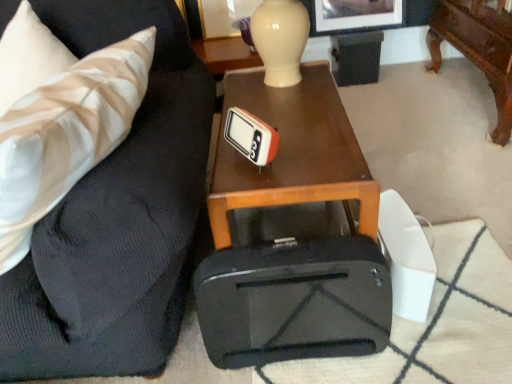
The width and height of the screenshot is (512, 384). In order to click on free location to the right of black matte suitcase at center in this screenshot , I will do `click(429, 343)`.